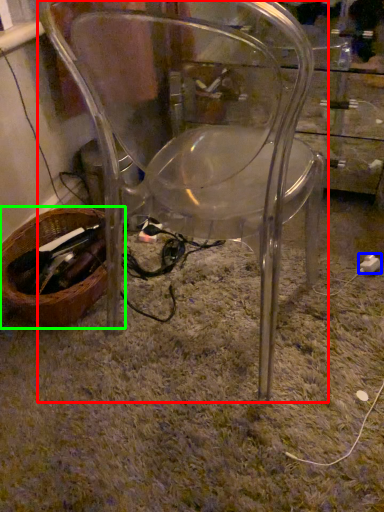
Question: Which object is the closest to the chair (highlighted by a red box)? Choose among these: plug (highlighted by a blue box) or basket (highlighted by a green box).

Choices:
 (A) plug
 (B) basket

Answer: (B)